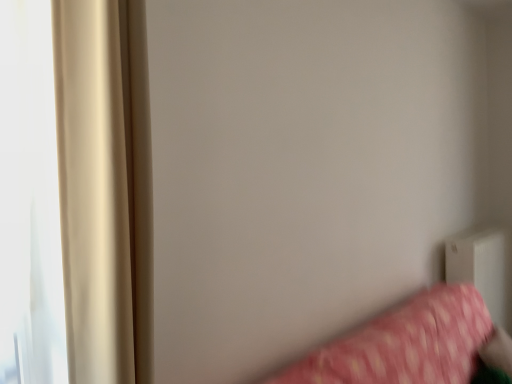
Question: Is beige satin curtain at left at the back of pink fabric bed at lower right?

Choices:
 (A) yes
 (B) no

Answer: (B)

Question: Considering the relative sizes of pink fabric bed at lower right and beige satin curtain at left in the image provided, is pink fabric bed at lower right shorter than beige satin curtain at left?

Choices:
 (A) no
 (B) yes

Answer: (B)

Question: Can you confirm if pink fabric bed at lower right is taller than beige satin curtain at left?

Choices:
 (A) no
 (B) yes

Answer: (A)

Question: Does pink fabric bed at lower right have a greater width compared to beige satin curtain at left?

Choices:
 (A) no
 (B) yes

Answer: (B)

Question: Can beige satin curtain at left be found inside pink fabric bed at lower right?

Choices:
 (A) no
 (B) yes

Answer: (A)

Question: Is white plastic radiator at lower right wider or thinner than pink fabric bed at lower right?

Choices:
 (A) wide
 (B) thin

Answer: (B)

Question: Considering the positions of white plastic radiator at lower right and pink fabric bed at lower right in the image, is white plastic radiator at lower right bigger or smaller than pink fabric bed at lower right?

Choices:
 (A) big
 (B) small

Answer: (B)

Question: Would you say white plastic radiator at lower right is inside or outside pink fabric bed at lower right?

Choices:
 (A) inside
 (B) outside

Answer: (B)

Question: From the image's perspective, relative to pink fabric bed at lower right, is white plastic radiator at lower right above or below?

Choices:
 (A) below
 (B) above

Answer: (B)

Question: Is beige satin curtain at left spatially inside white plastic radiator at lower right, or outside of it?

Choices:
 (A) outside
 (B) inside

Answer: (A)

Question: Considering the positions of beige satin curtain at left and white plastic radiator at lower right in the image, is beige satin curtain at left taller or shorter than white plastic radiator at lower right?

Choices:
 (A) tall
 (B) short

Answer: (A)

Question: Would you say beige satin curtain at left is to the left or to the right of white plastic radiator at lower right in the picture?

Choices:
 (A) right
 (B) left

Answer: (B)

Question: From the image's perspective, is beige satin curtain at left positioned above or below white plastic radiator at lower right?

Choices:
 (A) above
 (B) below

Answer: (A)

Question: Is pink fabric bed at lower right taller or shorter than white plastic radiator at lower right?

Choices:
 (A) short
 (B) tall

Answer: (A)

Question: From the image's perspective, is pink fabric bed at lower right above or below white plastic radiator at lower right?

Choices:
 (A) below
 (B) above

Answer: (A)